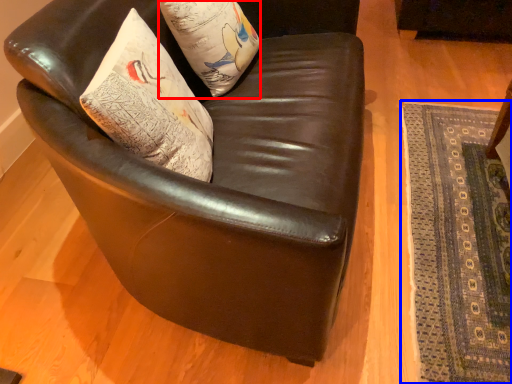
Question: Which point is further to the camera, pillow (highlighted by a red box) or mat (highlighted by a blue box)?

Choices:
 (A) pillow
 (B) mat

Answer: (A)